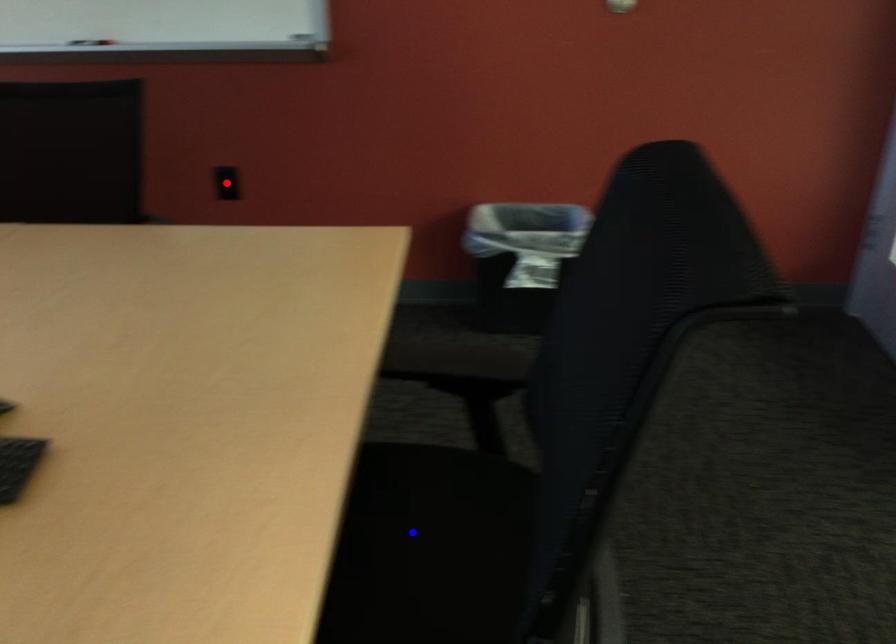
Question: Two points are marked on the image. Which point is closer to the camera?

Choices:
 (A) Blue point is closer.
 (B) Red point is closer.

Answer: (A)